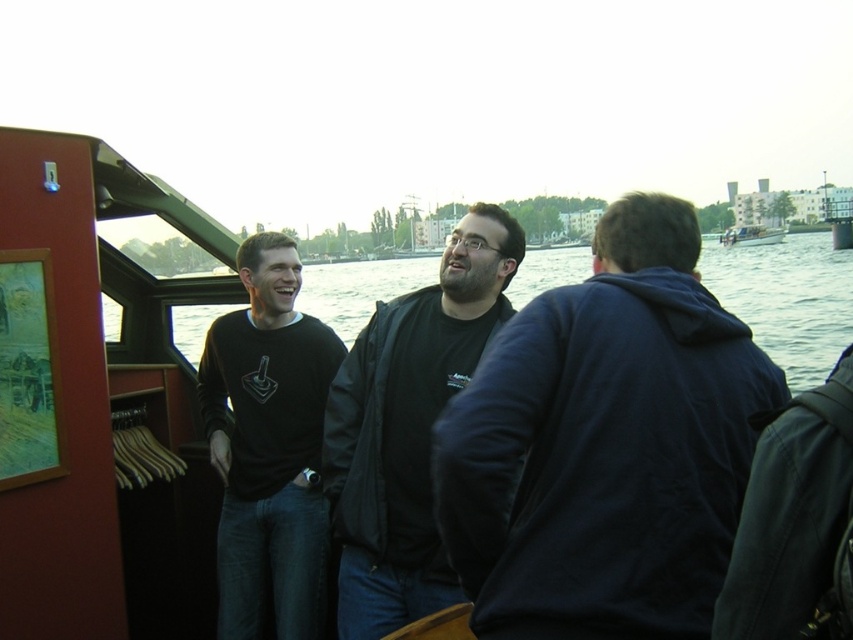
Who is positioned more to the right, matte black jacket at center or white plastic boat at upper right?

Positioned to the right is white plastic boat at upper right.

Does point (398, 500) come farther from viewer compared to point (750, 236)?

No.

Between point (486, 328) and point (735, 230), which one is positioned in front?

Positioned in front is point (486, 328).

You are a GUI agent. You are given a task and a screenshot of the screen. Output one action in this format:
    pyautogui.click(x=<x>, y=<y>)
    Task: Click on the matte black jacket at center
    This screenshot has width=853, height=640.
    Given the screenshot: What is the action you would take?
    pyautogui.click(x=408, y=426)

Is point (425, 289) in front of point (822, 273)?

Yes.

Is matte black jacket at center above clear water at center?

No, matte black jacket at center is not above clear water at center.

Describe the element at coordinates (408, 426) in the screenshot. Image resolution: width=853 pixels, height=640 pixels. I see `matte black jacket at center` at that location.

The height and width of the screenshot is (640, 853). Identify the location of matte black jacket at center. (408, 426).

The height and width of the screenshot is (640, 853). I want to click on dark blue hoodie at center, so click(x=605, y=445).

Who is more forward, (x=741, y=481) or (x=216, y=556)?

Point (x=741, y=481)

Is point (500, 342) closer to camera compared to point (294, 493)?

That is True.

At what (x,y) coordinates should I click in order to perform the action: click on dark blue hoodie at center. Please return your answer as a coordinate pair (x, y). The width and height of the screenshot is (853, 640). Looking at the image, I should click on (605, 445).